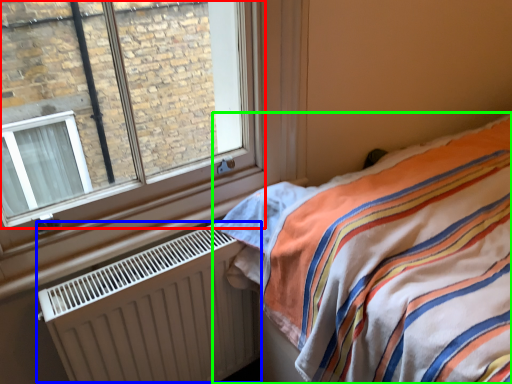
Question: Which object is the closest to the window (highlighted by a red box)? Choose among these: radiator (highlighted by a blue box) or bed (highlighted by a green box).

Choices:
 (A) radiator
 (B) bed

Answer: (A)